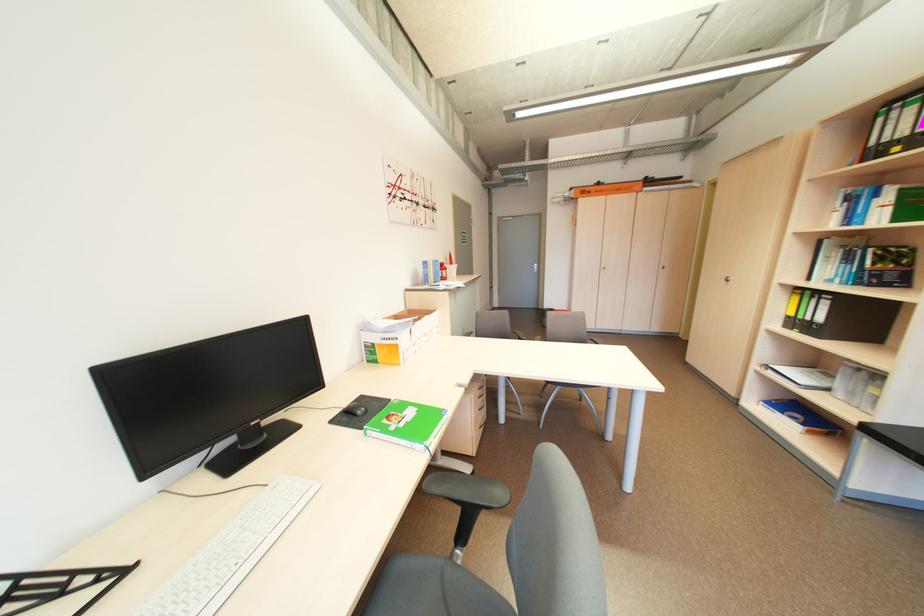
Locate an element on the screen. The width and height of the screenshot is (924, 616). yellow binder is located at coordinates (606, 188).